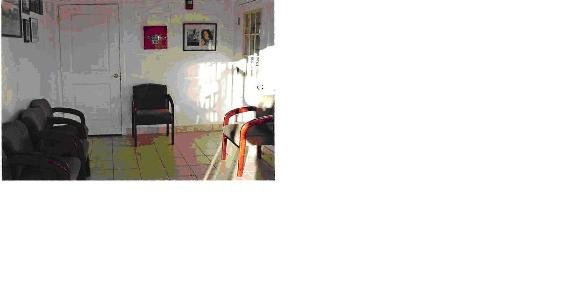
At what (x,y) coordinates should I click in order to perform the action: click on chair in sunlight. Please return your answer as a coordinate pair (x, y). This screenshot has width=576, height=294. Looking at the image, I should click on (234, 132).